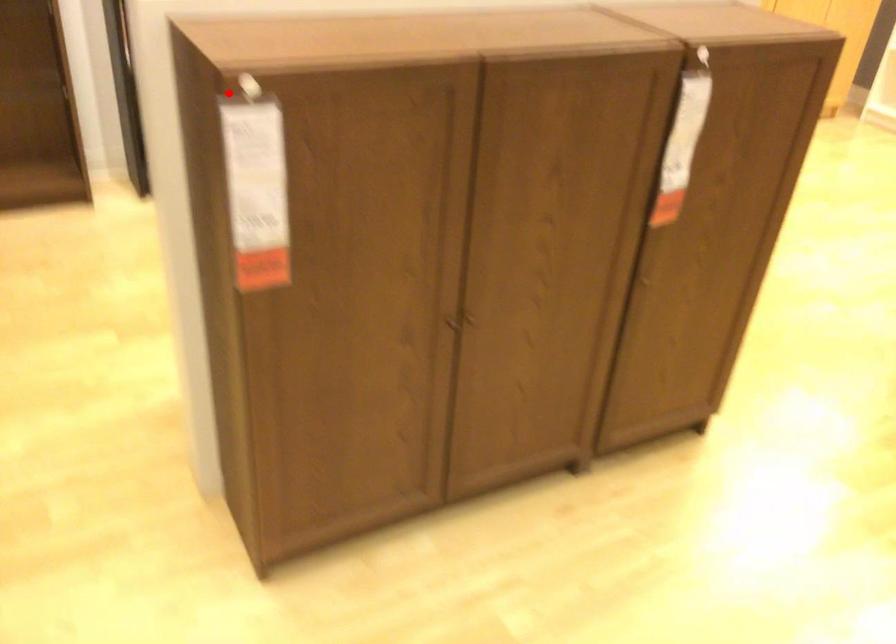
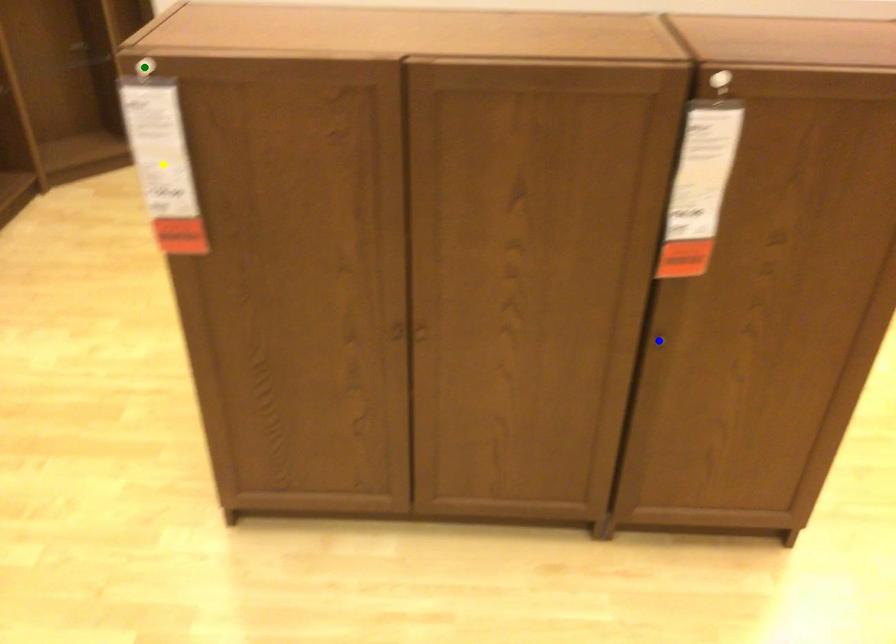
Question: I am providing you with two images of the same scene from different viewpoints. A red point is marked on the first image. You are given multiple points on the second image. Which mark in image 2 goes with the point in image 1?

Choices:
 (A) blue point
 (B) yellow point
 (C) green point

Answer: (C)